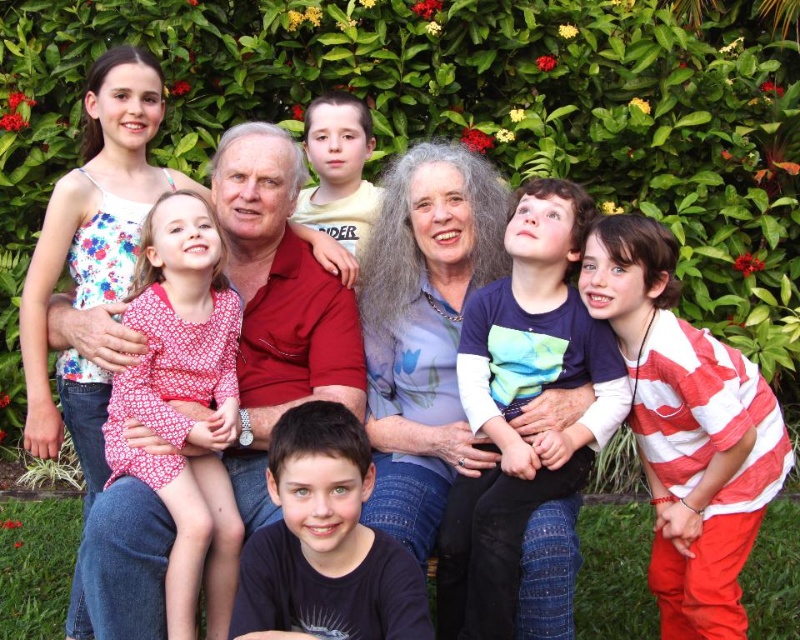
Question: Can you confirm if dark blue cotton shirt at center is bigger than floral fabric blouse at center?

Choices:
 (A) yes
 (B) no

Answer: (B)

Question: Which object is positioned closest to the dark blue cotton shirt at center?

Choices:
 (A) white striped shirt at center right
 (B) pink floral dress at center
 (C) floral fabric blouse at center
 (D) matte red shirt at upper center

Answer: (C)

Question: Considering the real-world distances, which object is farthest from the yellow cotton shirt at upper center?

Choices:
 (A) dark blue shirt at center
 (B) dark blue cotton shirt at center

Answer: (A)

Question: Observing the image, what is the correct spatial positioning of dark blue cotton shirt at center in reference to matte red shirt at upper center?

Choices:
 (A) right
 (B) left

Answer: (A)

Question: Considering the relative positions of matte red shirt at upper center and pink floral dress at center in the image provided, where is matte red shirt at upper center located with respect to pink floral dress at center?

Choices:
 (A) above
 (B) below

Answer: (A)

Question: Which object appears closest to the camera in this image?

Choices:
 (A) matte red shirt at upper center
 (B) pink floral dress at center

Answer: (B)